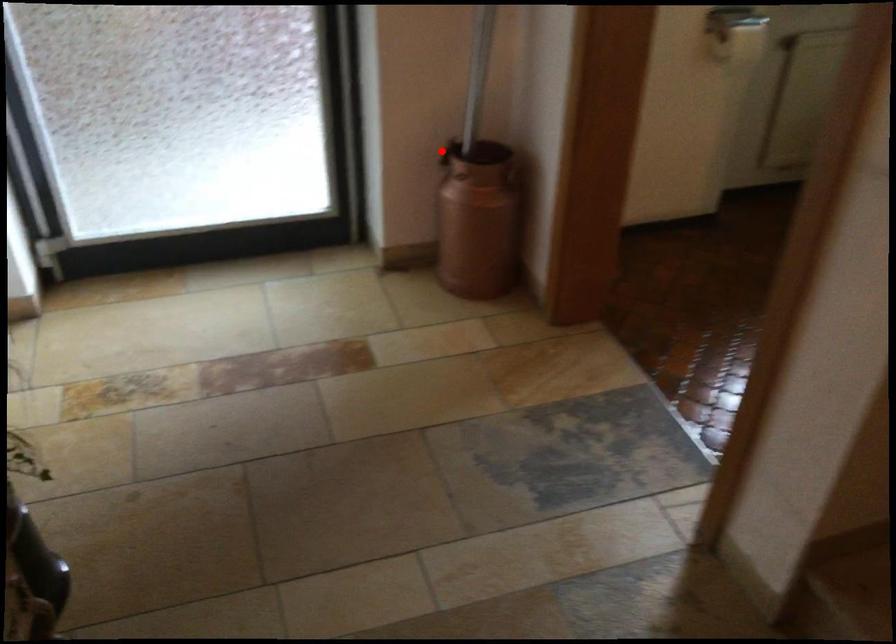
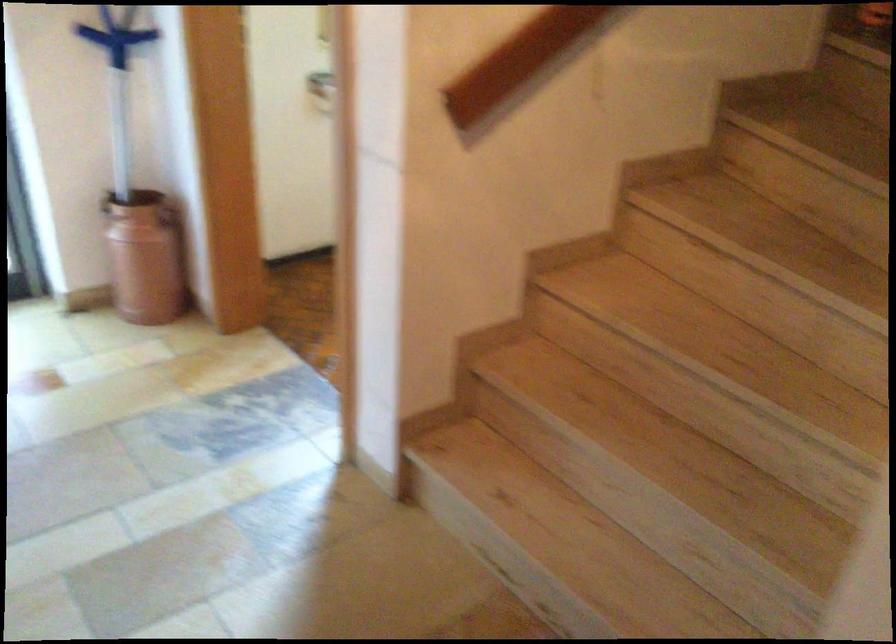
Question: A red point is marked in image1. In image2, is the corresponding 3D point closer to the camera or farther? Reply with the corresponding letter.

Choices:
 (A) The corresponding 3D point is closer.
 (B) The corresponding 3D point is farther.

Answer: (B)